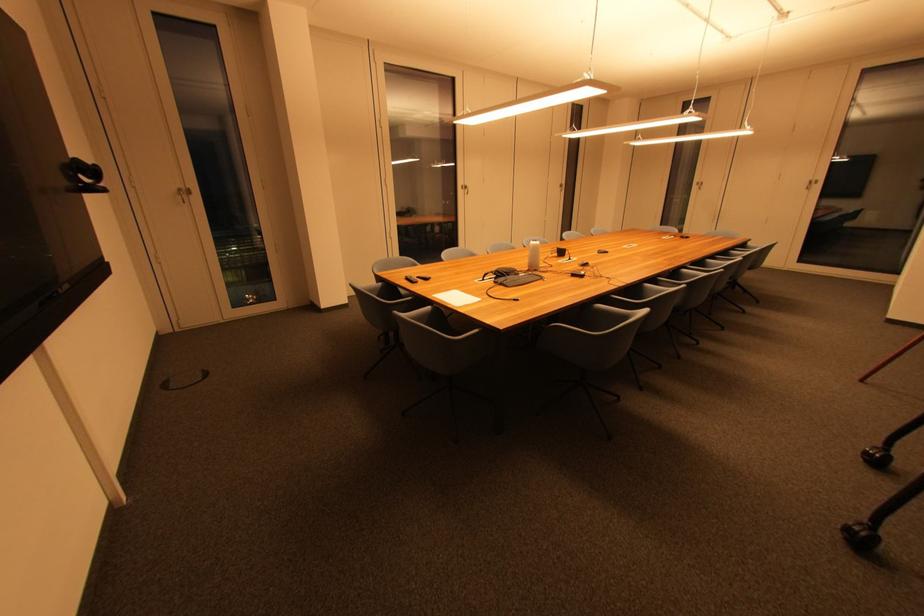
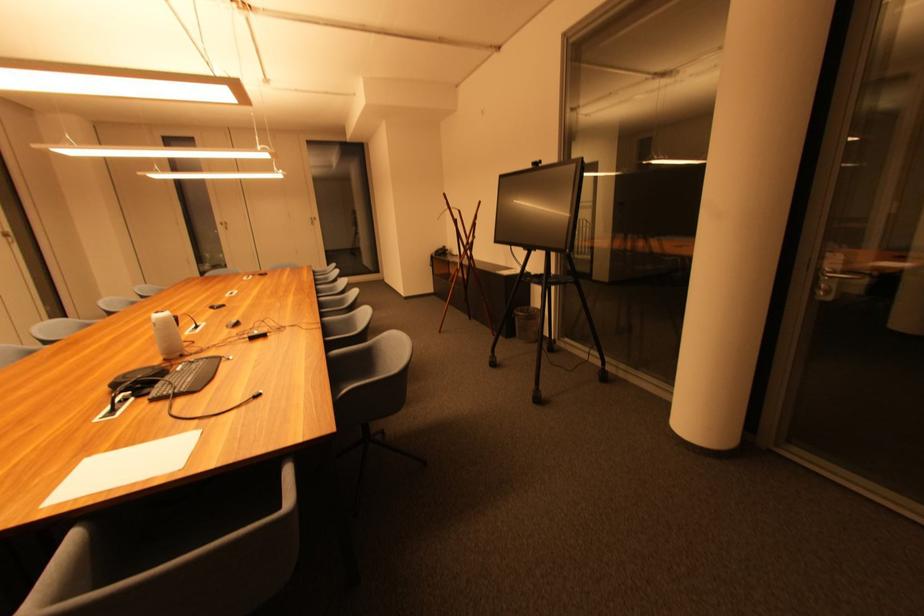
Where in the second image is the point corresponding to pixel 487 281 from the first image?

(114, 411)